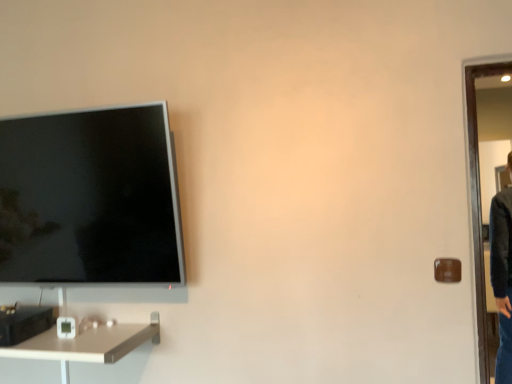
Question: From a real-world perspective, is brown matte door handle at right physically located above or below white glossy desk at lower left?

Choices:
 (A) above
 (B) below

Answer: (A)

Question: From the image's perspective, is brown matte door handle at right positioned above or below white glossy desk at lower left?

Choices:
 (A) below
 (B) above

Answer: (B)

Question: In terms of height, does brown matte door handle at right look taller or shorter compared to white glossy desk at lower left?

Choices:
 (A) tall
 (B) short

Answer: (A)

Question: Is white glossy desk at lower left situated inside brown matte door handle at right or outside?

Choices:
 (A) inside
 (B) outside

Answer: (B)

Question: In terms of width, does white glossy desk at lower left look wider or thinner when compared to brown matte door handle at right?

Choices:
 (A) wide
 (B) thin

Answer: (A)

Question: Considering the relative positions of white glossy desk at lower left and brown matte door handle at right in the image provided, is white glossy desk at lower left to the left or to the right of brown matte door handle at right?

Choices:
 (A) right
 (B) left

Answer: (B)

Question: Does point (53, 329) appear closer or farther from the camera than point (456, 269)?

Choices:
 (A) closer
 (B) farther

Answer: (B)